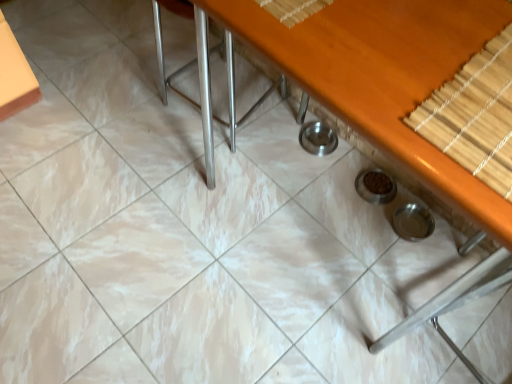
Identify the location of free space to the left of satin silver chair at center. This screenshot has width=512, height=384. pyautogui.click(x=122, y=98).